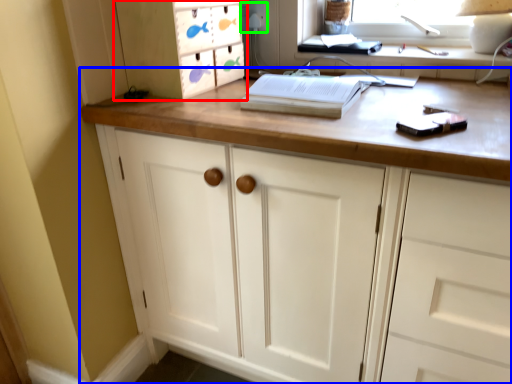
Question: Estimate the real-world distances between objects in this image. Which object is farther from cabinetry (highlighted by a red box), chest of drawers (highlighted by a blue box) or electric outlet (highlighted by a green box)?

Choices:
 (A) chest of drawers
 (B) electric outlet

Answer: (B)